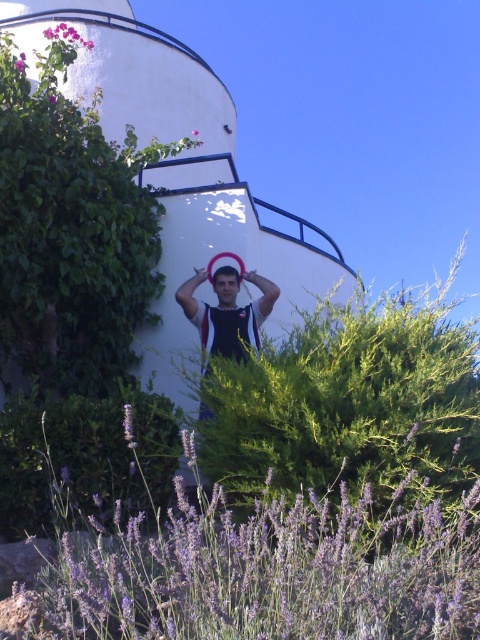
Is purple soft lavender at lower center further to the viewer compared to matte black tank top at center?

No, purple soft lavender at lower center is in front of matte black tank top at center.

Is point (291, 524) farther from viewer compared to point (196, 316)?

That is False.

Identify the location of purple soft lavender at lower center. The image size is (480, 640). (265, 573).

The image size is (480, 640). Identify the location of purple soft lavender at lower center. (265, 573).

Which is more to the left, matte black tank top at center or smooth skin head at center?

smooth skin head at center is more to the left.

Is point (225, 284) positioned behind point (222, 284)?

No, (225, 284) is closer to viewer.

This screenshot has width=480, height=640. In order to click on matte black tank top at center in this screenshot , I will do `click(227, 310)`.

Is purple soft lavender at lower center shorter than smooth skin head at center?

No, purple soft lavender at lower center is not shorter than smooth skin head at center.

Does purple soft lavender at lower center appear over smooth skin head at center?

No.

What do you see at coordinates (265, 573) in the screenshot? The image size is (480, 640). I see `purple soft lavender at lower center` at bounding box center [265, 573].

Identify the location of purple soft lavender at lower center. Image resolution: width=480 pixels, height=640 pixels. pyautogui.click(x=265, y=573).